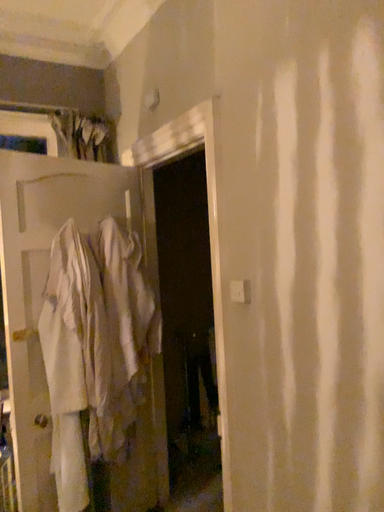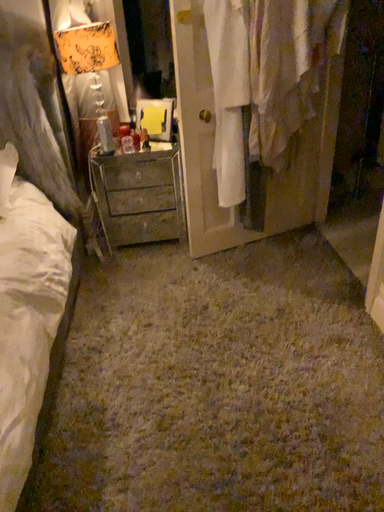
Question: How did the camera likely rotate when shooting the video?

Choices:
 (A) rotated downward
 (B) rotated upward

Answer: (A)